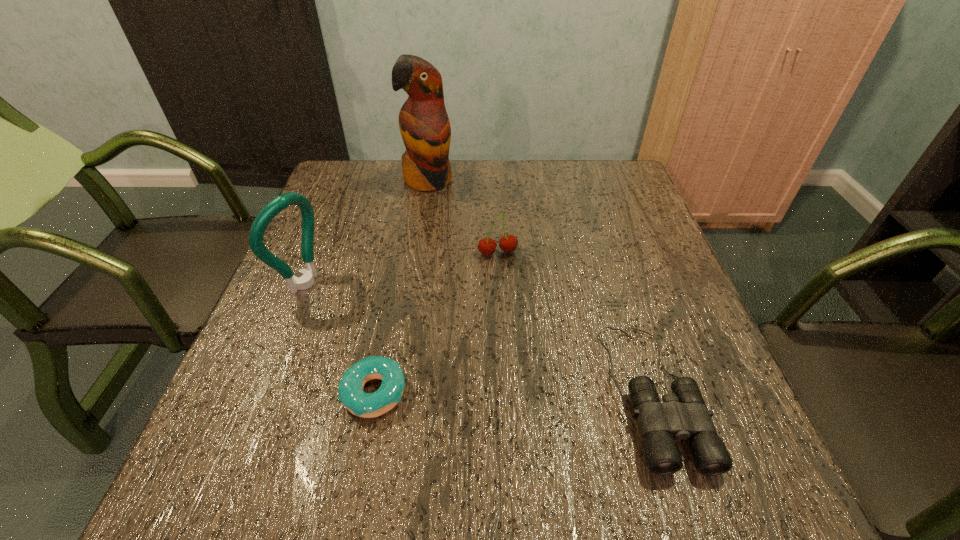
Where is `doughnut that is at the near edge`? This screenshot has height=540, width=960. doughnut that is at the near edge is located at coordinates (350, 389).

The width and height of the screenshot is (960, 540). I want to click on binoculars situated at the near edge, so click(683, 414).

This screenshot has height=540, width=960. In order to click on object present at the left edge in this screenshot , I will do `click(281, 202)`.

Where is `object at the right edge`? The image size is (960, 540). object at the right edge is located at coordinates (683, 414).

The width and height of the screenshot is (960, 540). Identify the location of object that is at the near right corner. (683, 414).

This screenshot has height=540, width=960. I want to click on free region at the far edge of the desktop, so click(381, 205).

Where is `vacant space at the near edge of the desktop`? Image resolution: width=960 pixels, height=540 pixels. vacant space at the near edge of the desktop is located at coordinates (434, 401).

In the image, there is a desktop. Where is `vacant area at the left edge`? vacant area at the left edge is located at coordinates (345, 246).

Identify the location of free space at the right edge of the desktop. Image resolution: width=960 pixels, height=540 pixels. (590, 221).

Find the location of a particular element. This screenshot has height=540, width=960. vacant space at the far left corner is located at coordinates (359, 201).